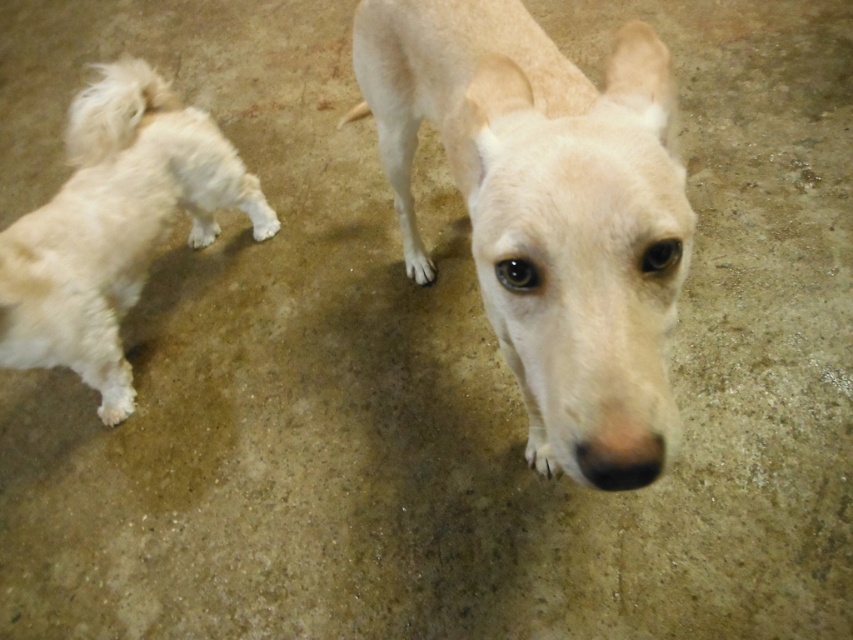
You are standing in front of the two dogs in the image. If you want to pet the light beige fur dog at center first, which direction should you move to reach it from the white fluffy dog at left?

The light beige fur dog at center is to the right of the white fluffy dog at left, so you should move to the right to reach it first.